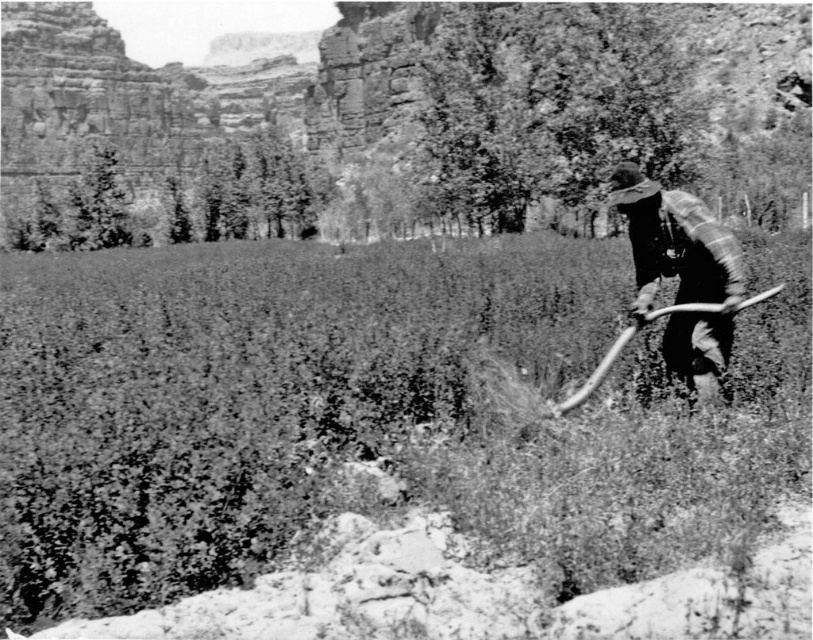
Question: Which point appears farthest from the camera in this image?

Choices:
 (A) (733, 310)
 (B) (629, 346)

Answer: (B)

Question: Is coarse textured grass at center bigger than plaid fabric shirt at right?

Choices:
 (A) no
 (B) yes

Answer: (B)

Question: Which of the following is the closest to the observer?

Choices:
 (A) coarse textured grass at center
 (B) plaid fabric shirt at right

Answer: (A)

Question: Is coarse textured grass at center wider than plaid fabric shirt at right?

Choices:
 (A) no
 (B) yes

Answer: (B)

Question: Which object appears closest to the camera in this image?

Choices:
 (A) plaid fabric shirt at right
 (B) coarse textured grass at center

Answer: (B)

Question: Can you confirm if coarse textured grass at center is positioned to the left of plaid fabric shirt at right?

Choices:
 (A) no
 (B) yes

Answer: (B)